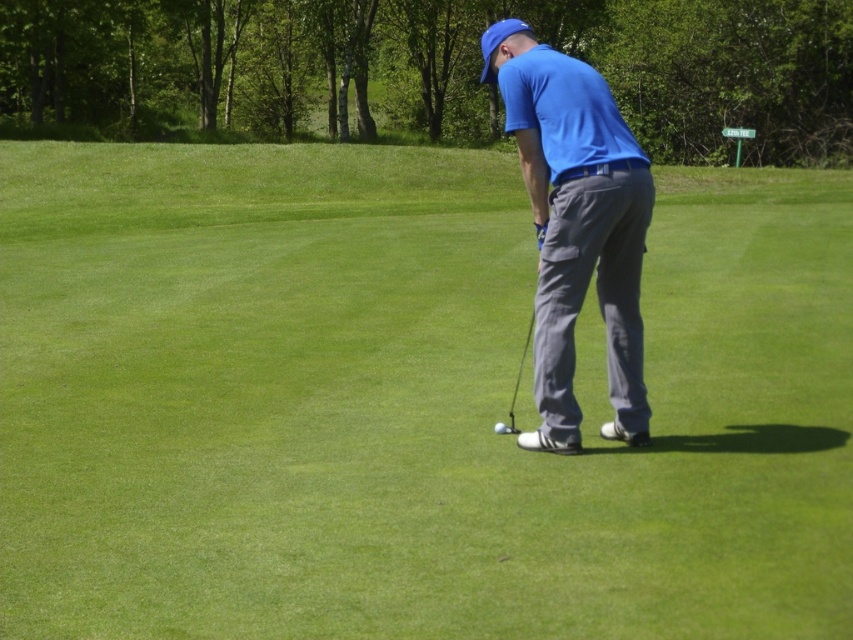
Question: Which object is farther from the camera taking this photo?

Choices:
 (A) blue cotton shirt at center
 (B) matte blue polo shirt at center
 (C) metallic silver golf club at center
 (D) white matte golf ball at center

Answer: (C)

Question: Is blue cotton shirt at center below metallic silver golf club at center?

Choices:
 (A) yes
 (B) no

Answer: (B)

Question: Can you confirm if matte blue polo shirt at center is wider than metallic silver golf club at center?

Choices:
 (A) no
 (B) yes

Answer: (B)

Question: Is matte blue polo shirt at center to the left of metallic silver golf club at center from the viewer's perspective?

Choices:
 (A) yes
 (B) no

Answer: (B)

Question: Based on their relative distances, which object is nearer to the blue cotton shirt at center?

Choices:
 (A) matte blue polo shirt at center
 (B) white matte golf ball at center
 (C) metallic silver golf club at center

Answer: (A)

Question: Which point is closer to the camera?

Choices:
 (A) metallic silver golf club at center
 (B) blue cotton shirt at center
 (C) matte blue polo shirt at center
 (D) white matte golf ball at center

Answer: (B)